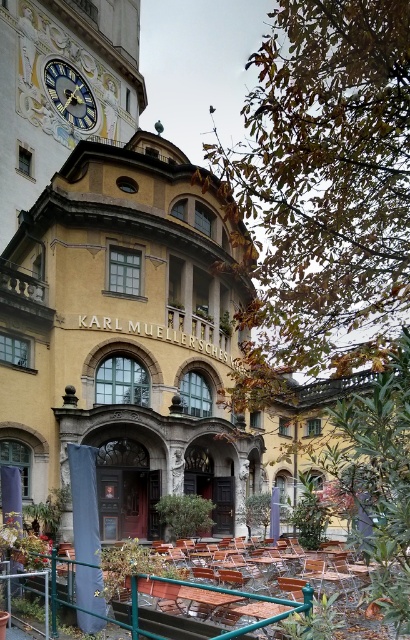
You are standing in front of the historic building and want to walk towards the green metal rail at lower center. Which direction should you turn to face the gold metallic clock at upper left?

The green metal rail at lower center is to the right of the gold metallic clock at upper left, so to face the gold metallic clock at upper left, you should turn to your left.

You are standing in front of the yellow stone building at center and the green metal rail at lower center. Which object is positioned to the left from your perspective?

The yellow stone building at center is positioned to the left of the green metal rail at lower center.

You are a tourist standing in front of the yellow stone building at center and the gold metallic clock at upper left. Which object would appear larger to you?

The yellow stone building at center appears larger than the gold metallic clock at upper left because it is much taller.